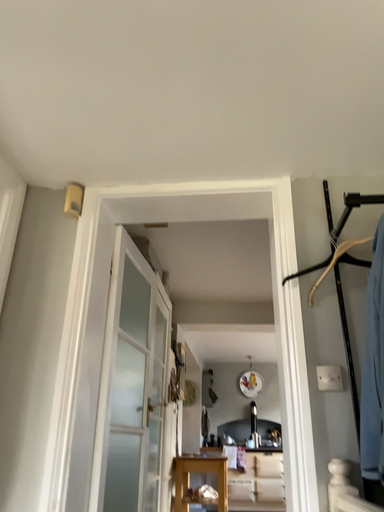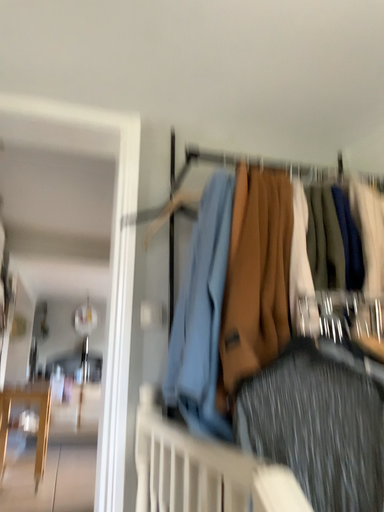
Question: How did the camera likely rotate when shooting the video?

Choices:
 (A) rotated downward
 (B) rotated upward

Answer: (A)